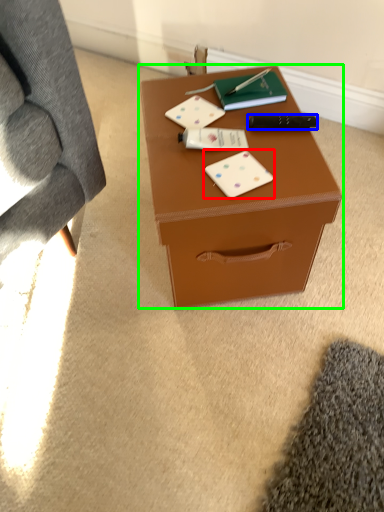
Question: Which is farther away from card game (highlighted by a red box)? stationery (highlighted by a blue box) or table (highlighted by a green box)?

Choices:
 (A) stationery
 (B) table

Answer: (A)